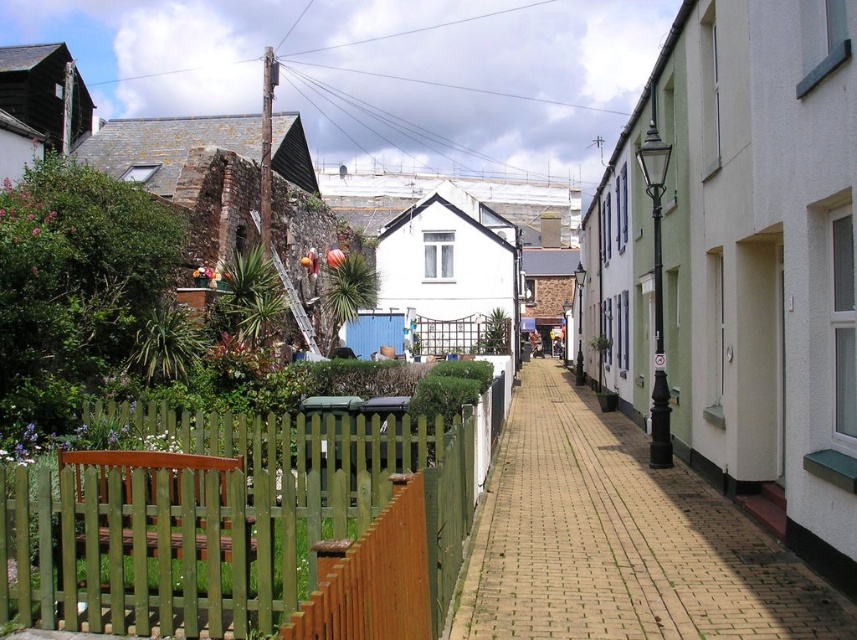
Is green wooden fence at lower left thinner than brick paved walkway at center?

Indeed, green wooden fence at lower left has a lesser width compared to brick paved walkway at center.

Between point (82, 614) and point (852, 621), which one is positioned in front?

Positioned in front is point (852, 621).

Image resolution: width=857 pixels, height=640 pixels. I want to click on green wooden fence at lower left, so click(219, 518).

Image resolution: width=857 pixels, height=640 pixels. Find the location of `green wooden fence at lower left`. green wooden fence at lower left is located at coordinates (219, 518).